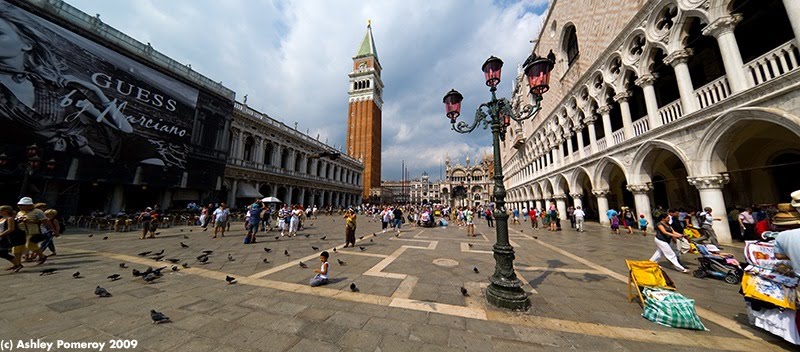
Find the location of a particular element. The width and height of the screenshot is (800, 352). light is located at coordinates (490, 70).